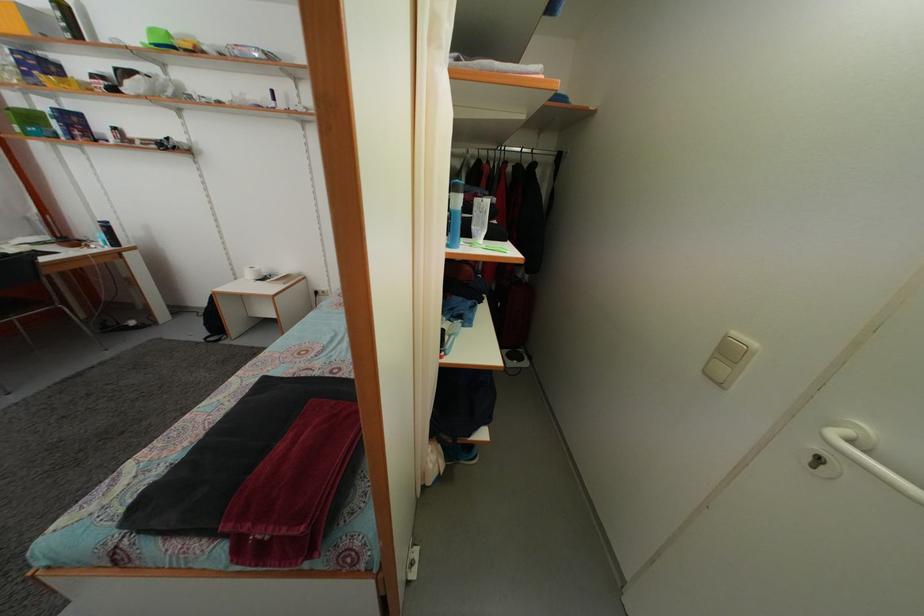
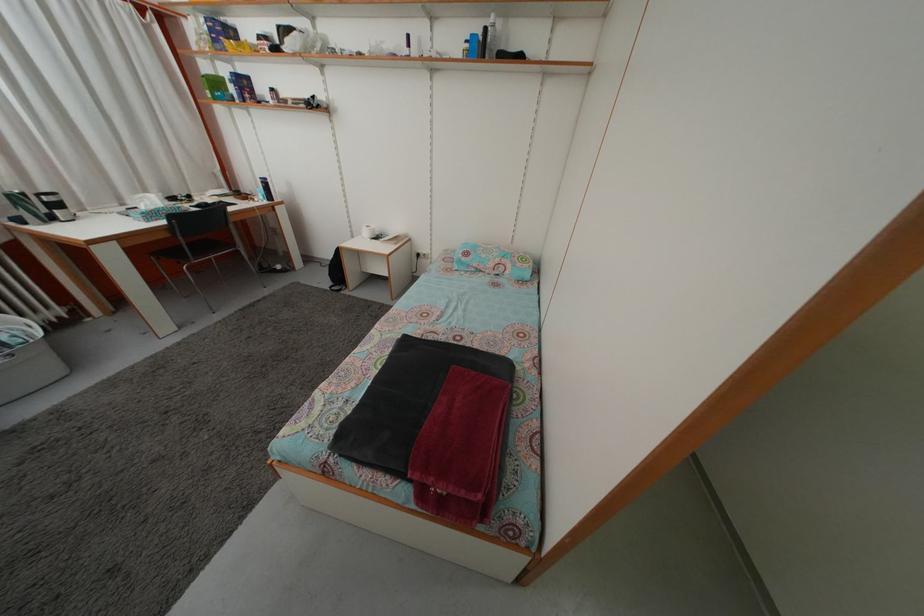
Where in the second image is the point corresponding to point 210,310 from the first image?

(335, 262)